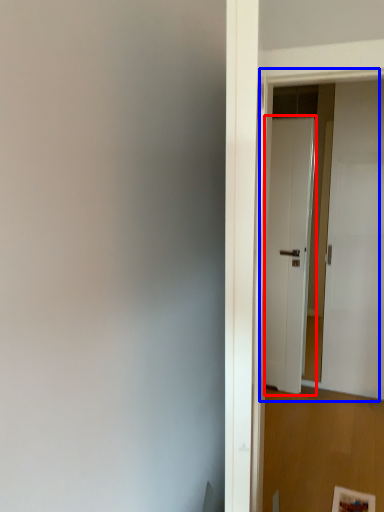
Question: Which of the following is the farthest to the observer, door (highlighted by a red box) or door (highlighted by a blue box)?

Choices:
 (A) door
 (B) door

Answer: (A)